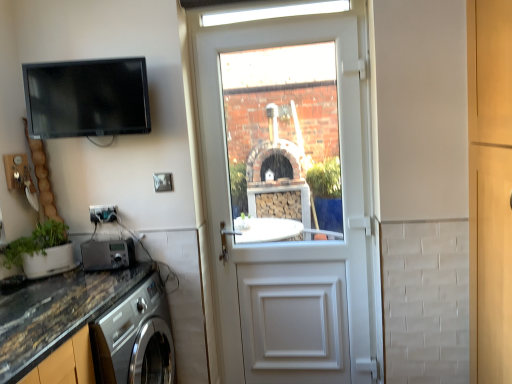
Question: Does point (282, 195) appear closer or farther from the camera than point (120, 244)?

Choices:
 (A) farther
 (B) closer

Answer: (A)

Question: Choose the correct answer: Is white plastic door at center inside metallic silver radio at lower left, placed as the 1th appliance when sorted from bottom to top, or outside it?

Choices:
 (A) inside
 (B) outside

Answer: (B)

Question: Which object is the closest to the matte black tv at upper left, the 2th appliance positioned from the bottom?

Choices:
 (A) matte black electric outlet at lower left
 (B) metallic silver radio at lower left, placed as the 1th appliance when sorted from bottom to top
 (C) marble-like granite countertop at lower left
 (D) white plastic door at center
 (E) green matte plant at lower left

Answer: (A)

Question: Estimate the real-world distances between objects in this image. Which object is farther from the metallic silver radio at lower left, marked as the second appliance in a top-to-bottom arrangement?

Choices:
 (A) matte black tv at upper left, which is counted as the 1th appliance, starting from the top
 (B) marble-like granite countertop at lower left
 (C) white plastic door at center
 (D) matte black electric outlet at lower left
 (E) green matte plant at lower left

Answer: (C)